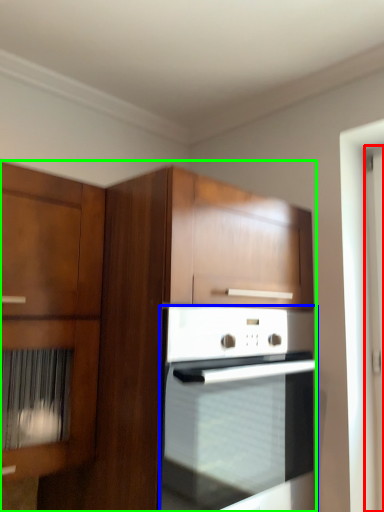
Question: Which is nearer to the screen door (highlighted by a red box)? oven (highlighted by a blue box) or cabinetry (highlighted by a green box).

Choices:
 (A) oven
 (B) cabinetry

Answer: (A)